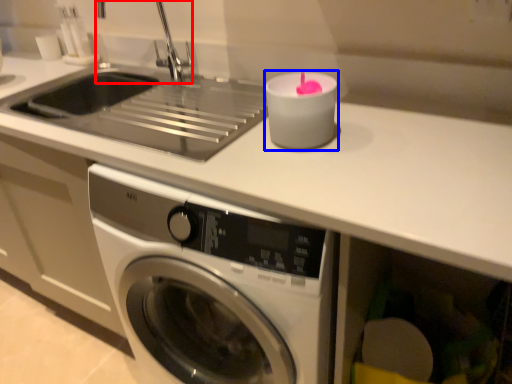
Question: Which object appears closest to the camera in this image, faucet (highlighted by a red box) or candle holder (highlighted by a blue box)?

Choices:
 (A) faucet
 (B) candle holder

Answer: (B)